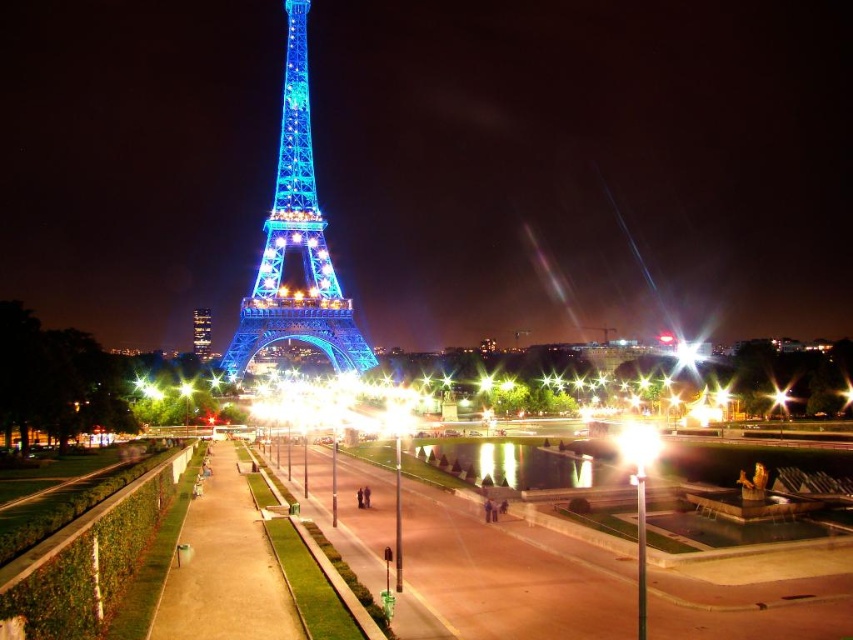
Does shiny blue metal eiffel tower at center have a greater width compared to shiny metallic tower at center?

Yes.

Which is in front, point (231, 376) or point (198, 323)?

Point (231, 376) is more forward.

Locate an element on the screen. This screenshot has height=640, width=853. shiny blue metal eiffel tower at center is located at coordinates (296, 243).